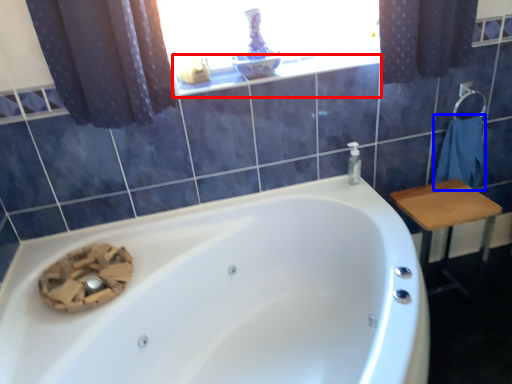
Question: Which object is closer to the camera taking this photo, window sill (highlighted by a red box) or bath towel (highlighted by a blue box)?

Choices:
 (A) window sill
 (B) bath towel

Answer: (A)